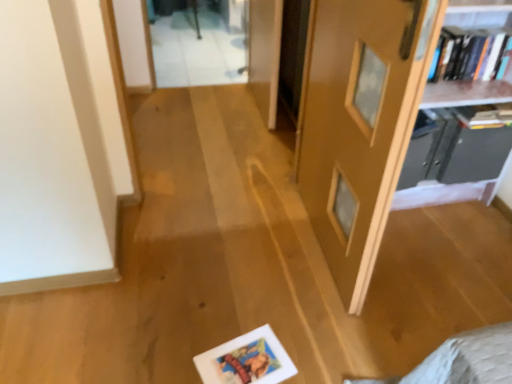
This screenshot has height=384, width=512. Identify the location of vacant region below white matte picture frame at lower center (from a real-world perspective). (246, 362).